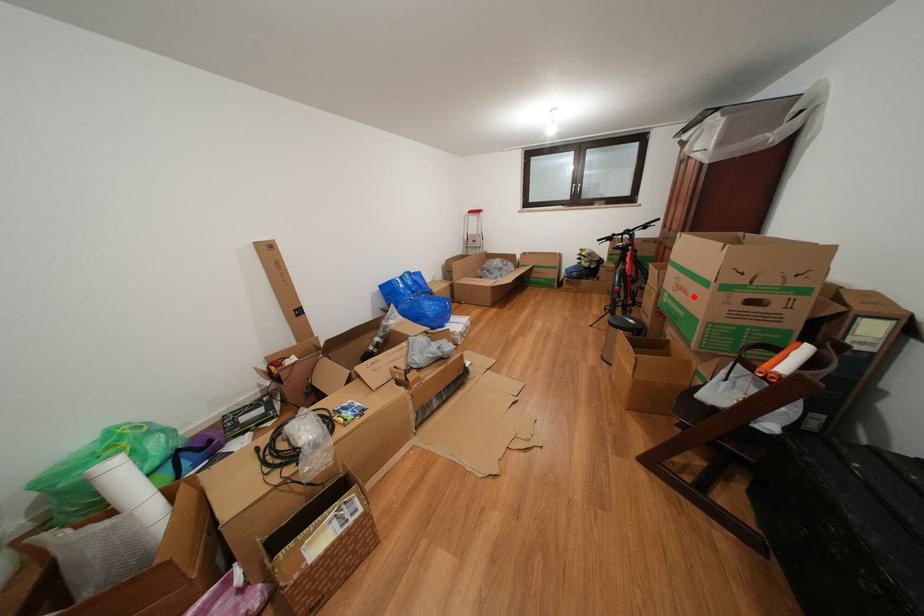
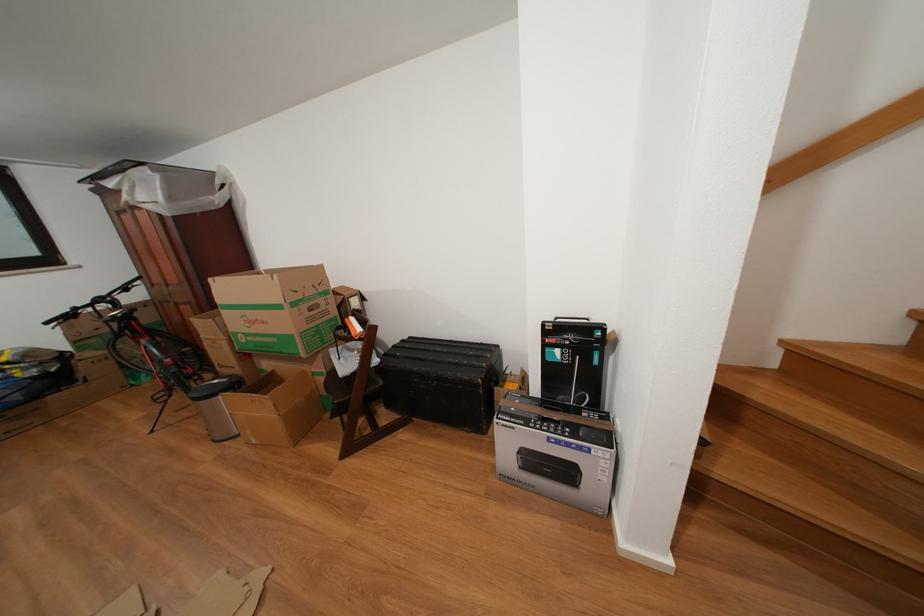
The point at the highlighted location is marked in the first image. Where is the corresponding point in the second image?

(272, 328)